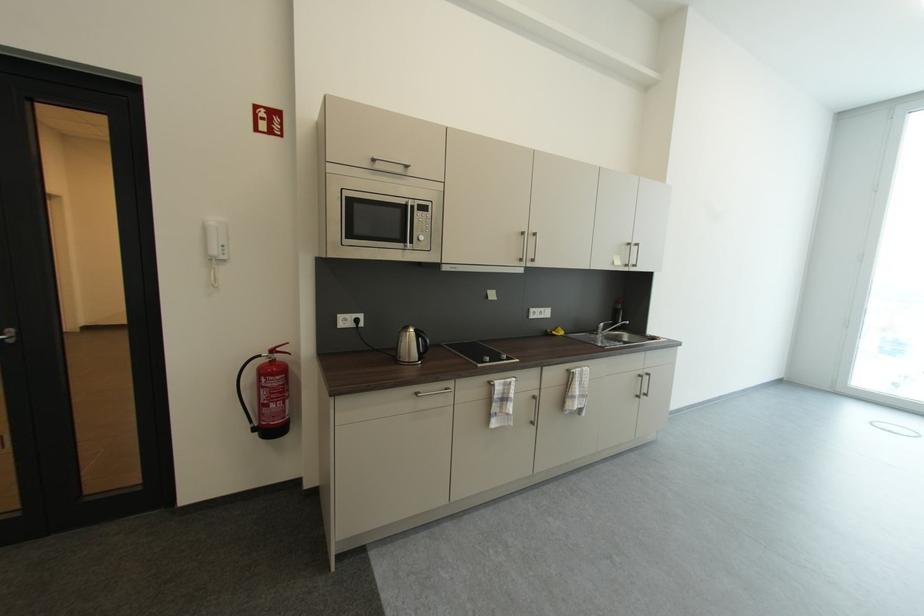
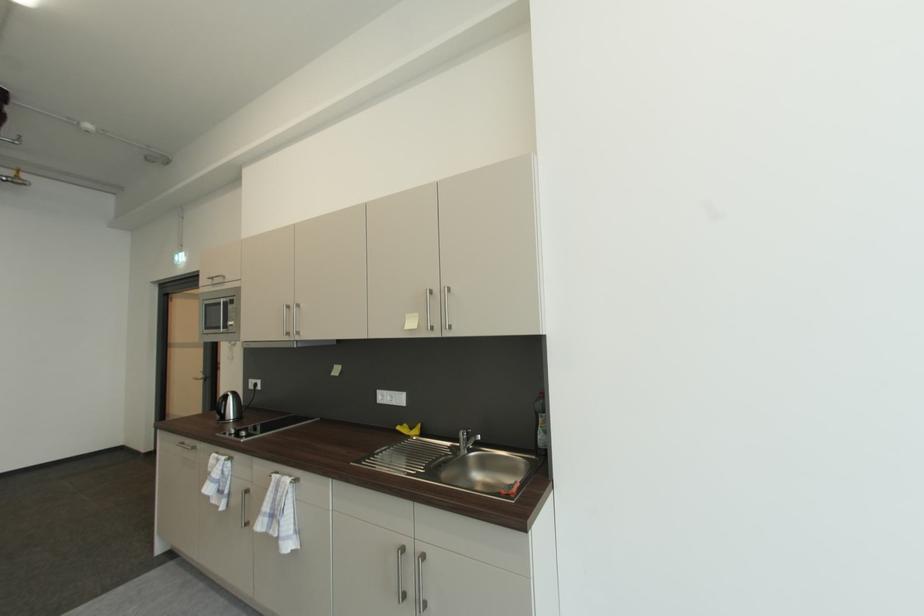
Where in the second image is the point corresponding to pixel 626 318 from the first image?

(545, 430)